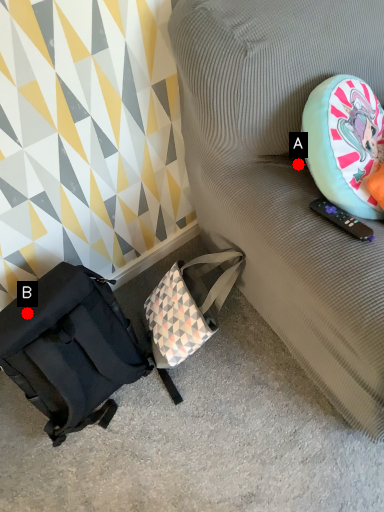
Question: Two points are circled on the image, labeled by A and B beside each circle. Which point appears closest to the camera in this image?

Choices:
 (A) A is closer
 (B) B is closer

Answer: (B)